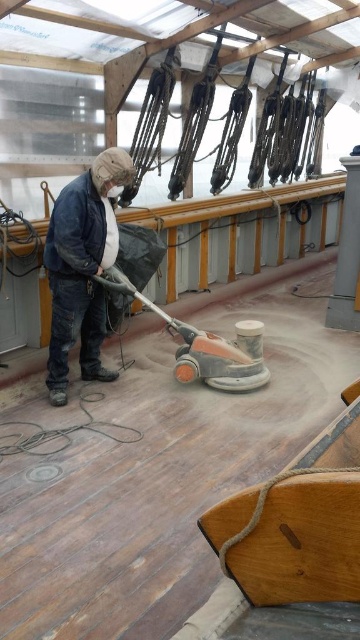
You are a safety inspector checking the workspace. You notice the brown polished wood at center and the orange rubber floor sander at center. Based on their sizes, is there a risk of the sander obstructing the walkway that is 1.2 meters wide?

The brown polished wood at center might be wider than orange rubber floor sander at center. Since the walkway is 1.2 meters wide, if the brown polished wood at center is indeed wider than the sander, it could potentially block the walkway. However, without exact measurements, we cannot confirm the exact risk.

From the picture: You are a safety inspector observing the scene. You need to determine if the matte blue jacket at center is covering the orange rubber floor sander at center. Based on the height of these objects, can you confirm if the jacket is covering the sander?

The matte blue jacket at center is taller than orange rubber floor sander at center, so it is possible that the jacket is covering the sander if positioned directly over it.

You are a safety inspector checking the workspace. You notice the matte blue jacket at center and the orange rubber floor sander at center. Which object takes up more space horizontally?

The orange rubber floor sander at center has a greater width than the matte blue jacket at center, so it takes up more horizontal space.